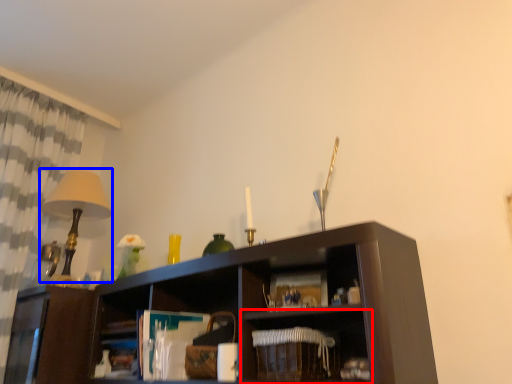
Question: Which object is closer to the camera taking this photo, shelf (highlighted by a red box) or table lamp (highlighted by a blue box)?

Choices:
 (A) shelf
 (B) table lamp

Answer: (A)